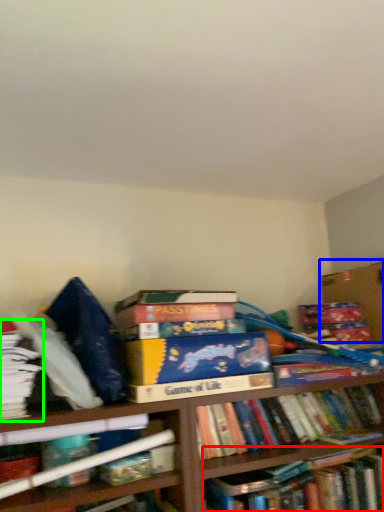
Question: Which is farther away from book (highlighted by a red box)? cardboard box (highlighted by a blue box) or book (highlighted by a green box)?

Choices:
 (A) cardboard box
 (B) book

Answer: (B)